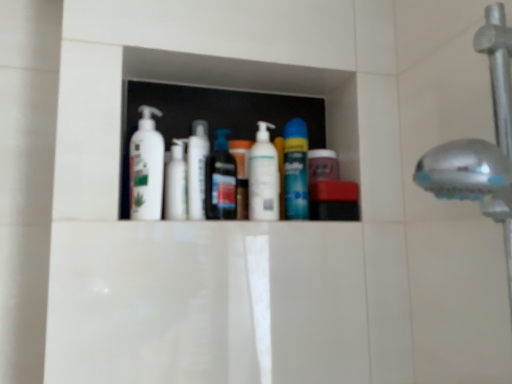
Question: Should I look upward or downward to see white glossy pump bottle at center, positioned as the third toiletry in left-to-right order?

Choices:
 (A) down
 (B) up

Answer: (B)

Question: Is white glossy lotion at center, which ranks as the first toiletry in left-to-right order, facing away from white glossy lotion at center, acting as the 2th toiletry starting from the right?

Choices:
 (A) no
 (B) yes

Answer: (A)

Question: Are white glossy lotion at center, which ranks as the first toiletry in left-to-right order, and white glossy lotion at center, placed as the second toiletry when sorted from left to right, far apart?

Choices:
 (A) no
 (B) yes

Answer: (A)

Question: Can you confirm if white glossy lotion at center, which ranks as the first toiletry in left-to-right order, is shorter than white glossy lotion at center, placed as the second toiletry when sorted from left to right?

Choices:
 (A) no
 (B) yes

Answer: (B)

Question: Is white glossy lotion at center, placed as the third toiletry when sorted from right to left, to the left of white glossy lotion at center, placed as the second toiletry when sorted from left to right, from the viewer's perspective?

Choices:
 (A) yes
 (B) no

Answer: (A)

Question: Is white glossy lotion at center, placed as the third toiletry when sorted from right to left, in front of white glossy lotion at center, placed as the second toiletry when sorted from left to right?

Choices:
 (A) no
 (B) yes

Answer: (A)

Question: Could you tell me if white glossy lotion at center, which ranks as the first toiletry in left-to-right order, is turned towards white glossy lotion at center, placed as the second toiletry when sorted from left to right?

Choices:
 (A) no
 (B) yes

Answer: (A)

Question: Are white glossy lotion at center, placed as the third toiletry when sorted from right to left, and blue glossy can at center, which ranks as the 2th mouthwash in left-to-right order, making contact?

Choices:
 (A) yes
 (B) no

Answer: (B)

Question: Is white glossy lotion at center, placed as the third toiletry when sorted from right to left, at the right side of blue glossy can at center, which is the 1th mouthwash in right-to-left order?

Choices:
 (A) yes
 (B) no

Answer: (B)

Question: Is white glossy lotion at center, placed as the third toiletry when sorted from right to left, turned away from blue glossy can at center, which is the 1th mouthwash in right-to-left order?

Choices:
 (A) yes
 (B) no

Answer: (B)

Question: From the image's perspective, does white glossy lotion at center, which ranks as the first toiletry in left-to-right order, appear higher than blue glossy can at center, which ranks as the 2th mouthwash in left-to-right order?

Choices:
 (A) no
 (B) yes

Answer: (A)

Question: Can you confirm if white glossy lotion at center, placed as the third toiletry when sorted from right to left, is positioned to the left of blue glossy can at center, which ranks as the 2th mouthwash in left-to-right order?

Choices:
 (A) no
 (B) yes

Answer: (B)

Question: Can blue glossy can at center, which ranks as the 2th mouthwash in left-to-right order, be found inside white glossy lotion at center, which ranks as the first toiletry in left-to-right order?

Choices:
 (A) no
 (B) yes

Answer: (A)

Question: Does blue glossy can at center, which is the 1th mouthwash in right-to-left order, contain white glossy pump bottle at center, the first toiletry from the right?

Choices:
 (A) yes
 (B) no

Answer: (B)